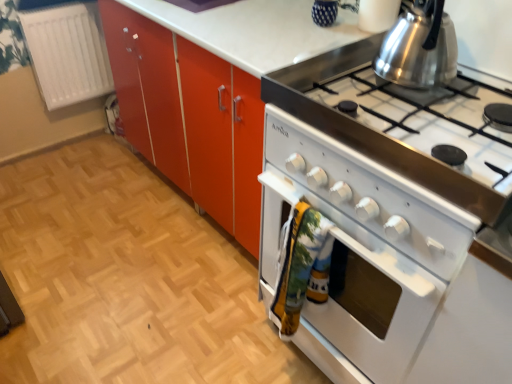
Question: Can you confirm if shiny metallic kettle at upper right is positioned to the right of white plastic radiator at left?

Choices:
 (A) no
 (B) yes

Answer: (B)

Question: Is shiny metallic kettle at upper right touching white plastic radiator at left?

Choices:
 (A) yes
 (B) no

Answer: (B)

Question: Is white plastic radiator at left at the back of shiny metallic kettle at upper right?

Choices:
 (A) no
 (B) yes

Answer: (A)

Question: From the image's perspective, would you say shiny metallic kettle at upper right is positioned over white plastic radiator at left?

Choices:
 (A) no
 (B) yes

Answer: (A)

Question: Is shiny metallic kettle at upper right bigger than white plastic radiator at left?

Choices:
 (A) yes
 (B) no

Answer: (B)

Question: Does shiny metallic kettle at upper right have a lesser width compared to white plastic radiator at left?

Choices:
 (A) no
 (B) yes

Answer: (A)

Question: Is white plastic radiator at left with white glossy oven at right?

Choices:
 (A) no
 (B) yes

Answer: (A)

Question: Is white plastic radiator at left turned away from white glossy oven at right?

Choices:
 (A) no
 (B) yes

Answer: (A)

Question: Can you confirm if white plastic radiator at left is bigger than white glossy oven at right?

Choices:
 (A) yes
 (B) no

Answer: (B)

Question: From the image's perspective, does white plastic radiator at left appear higher than white glossy oven at right?

Choices:
 (A) yes
 (B) no

Answer: (A)

Question: Is white plastic radiator at left oriented towards white glossy oven at right?

Choices:
 (A) yes
 (B) no

Answer: (A)

Question: Would you say white plastic radiator at left is a long distance from white glossy oven at right?

Choices:
 (A) no
 (B) yes

Answer: (B)

Question: From the image's perspective, is white glossy stove at right on top of white glossy oven at lower right?

Choices:
 (A) no
 (B) yes

Answer: (B)